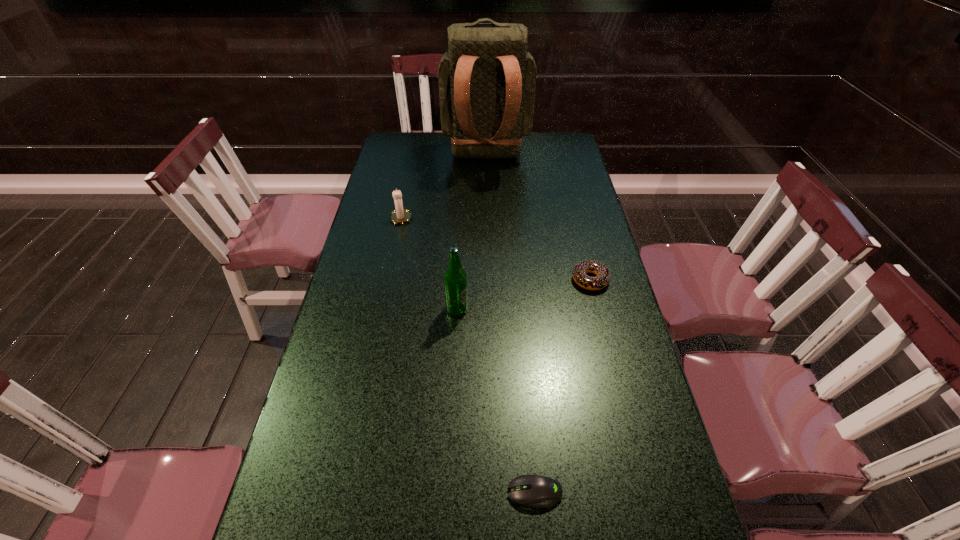
Where is `backpack`? Image resolution: width=960 pixels, height=540 pixels. backpack is located at coordinates (487, 79).

The height and width of the screenshot is (540, 960). Identify the location of the tallest object. (487, 79).

The image size is (960, 540). Identify the location of beer bottle. (455, 278).

Locate an element on the screen. Image resolution: width=960 pixels, height=540 pixels. the fourth farthest object is located at coordinates (455, 278).

Find the location of a particular element. This screenshot has height=540, width=960. the third tallest object is located at coordinates (399, 216).

This screenshot has height=540, width=960. Find the location of `the second farthest object`. the second farthest object is located at coordinates (399, 216).

Locate an element on the screen. The image size is (960, 540). the rightmost object is located at coordinates (579, 272).

Identify the location of doughnut. pos(579,272).

The height and width of the screenshot is (540, 960). Find the location of `the shortest object`. the shortest object is located at coordinates 538,491.

At what (x,y) coordinates should I click in order to perform the action: click on the nearest object. Please return your answer as a coordinate pair (x, y). Image resolution: width=960 pixels, height=540 pixels. Looking at the image, I should click on (538, 491).